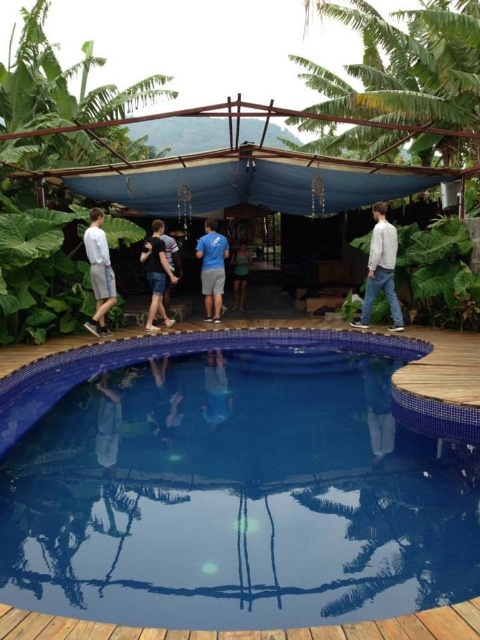
Who is lower down, green leafy palm tree at upper center or light gray cotton shorts at left?

light gray cotton shorts at left is lower down.

Which of these two, green leafy palm tree at upper center or light gray cotton shorts at left, stands taller?

green leafy palm tree at upper center is taller.

Does point (404, 102) lie in front of point (88, 232)?

That is False.

Where is `green leafy palm tree at upper center`? Image resolution: width=480 pixels, height=640 pixels. green leafy palm tree at upper center is located at coordinates (406, 65).

Is white cotton shirt at right thinner than blue glossy swimmer at center?

No, white cotton shirt at right is not thinner than blue glossy swimmer at center.

Is point (399, 320) behind point (216, 380)?

Yes, it is.

Find the location of a particular element. Image resolution: width=480 pixels, height=640 pixels. white cotton shirt at right is located at coordinates (381, 269).

Does green leafy palm tree at upper center have a greater width compared to blue glossy swimmer at center?

Correct, the width of green leafy palm tree at upper center exceeds that of blue glossy swimmer at center.

This screenshot has height=640, width=480. What do you see at coordinates (406, 65) in the screenshot? I see `green leafy palm tree at upper center` at bounding box center [406, 65].

Is point (368, 118) positioned before point (206, 416)?

No, (368, 118) is further to viewer.

Where is `green leafy palm tree at upper center`? green leafy palm tree at upper center is located at coordinates (406, 65).